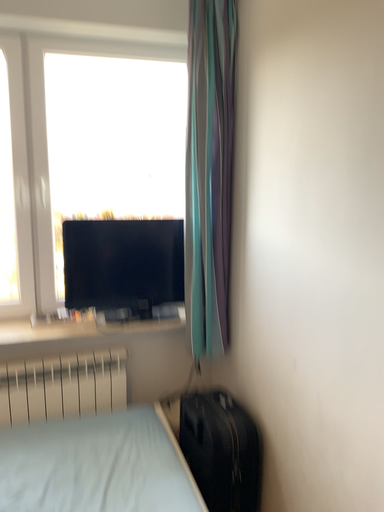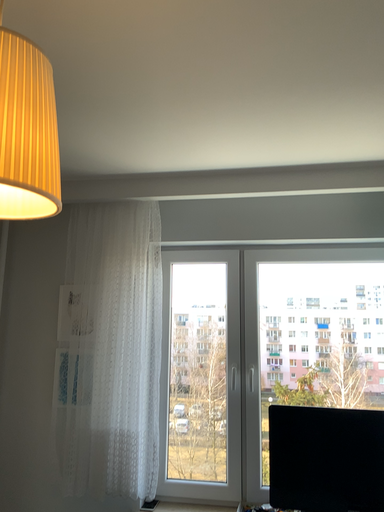
Question: How did the camera likely rotate when shooting the video?

Choices:
 (A) rotated upward
 (B) rotated downward

Answer: (A)